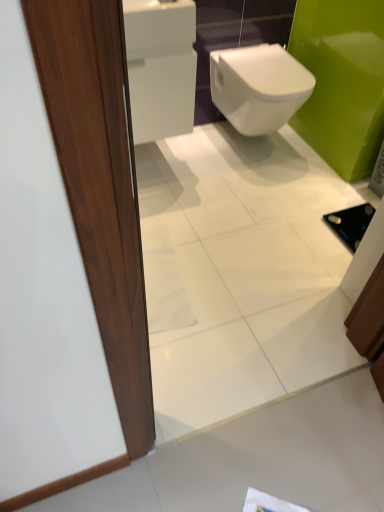
The width and height of the screenshot is (384, 512). What do you see at coordinates (239, 272) in the screenshot?
I see `matte wood door at left` at bounding box center [239, 272].

The height and width of the screenshot is (512, 384). Identify the location of white glossy tile at lower left. (107, 493).

The image size is (384, 512). What do you see at coordinates (107, 493) in the screenshot? I see `white glossy tile at lower left` at bounding box center [107, 493].

I want to click on white glossy bidet at center, so click(x=258, y=87).

Based on the photo, in order to face white glossy bidet at center, should I rotate leftwards or rightwards?

It's best to rotate right around 9.406 degrees.

Where is `matte wood door at left`? The image size is (384, 512). matte wood door at left is located at coordinates (239, 272).

Can you tell me how much white glossy tile at lower left and matte wood door at left differ in facing direction?

They differ by 180 degrees in their facing directions.

From the image's perspective, is white glossy tile at lower left on matte wood door at left?

No, from the image's perspective, white glossy tile at lower left is not over matte wood door at left.

Which of these two, white glossy tile at lower left or matte wood door at left, is bigger?

matte wood door at left is bigger.

Measure the distance between white glossy tile at lower left and matte wood door at left.

white glossy tile at lower left is 35.69 inches away from matte wood door at left.

Consider the image. How far apart are white paper at lower center and white glossy tile at lower left?

white paper at lower center is 38.47 centimeters away from white glossy tile at lower left.

Would you say white paper at lower center is a long distance from white glossy tile at lower left?

white paper at lower center is actually quite close to white glossy tile at lower left.

Does white paper at lower center turn towards white glossy tile at lower left?

No, white paper at lower center does not turn towards white glossy tile at lower left.

Is white paper at lower center inside the boundaries of white glossy tile at lower left, or outside?

white paper at lower center is not inside white glossy tile at lower left, it's outside.

Considering the sizes of matte wood door at left and white paper at lower center in the image, is matte wood door at left wider or thinner than white paper at lower center?

Considering their sizes, matte wood door at left looks slimmer than white paper at lower center.

Considering the positions of point (169, 10) and point (258, 504), is point (169, 10) closer or farther from the camera than point (258, 504)?

Point (169, 10) is positioned farther from the camera compared to point (258, 504).

Which object is closer to the camera taking this photo, matte wood door at left or white paper at lower center?

matte wood door at left is in front.

Locate an element on the screen. The width and height of the screenshot is (384, 512). mirror on the right side of white paper at lower center is located at coordinates (239, 272).

I want to click on bidet above the white glossy tile at lower left (from the image's perspective), so click(x=258, y=87).

Does point (37, 504) lie behind point (247, 103)?

No, it is not.

How different are the orientations of white glossy tile at lower left and white glossy bidet at center in degrees?

The angular difference between white glossy tile at lower left and white glossy bidet at center is 0.0342 degrees.

Between white glossy tile at lower left and white glossy bidet at center, which one has smaller size?

Smaller between the two is white glossy tile at lower left.

Considering the relative sizes of white paper at lower center and white glossy bidet at center in the image provided, is white paper at lower center bigger than white glossy bidet at center?

No, white paper at lower center is not bigger than white glossy bidet at center.

Which is farther, (273,504) or (213,77)?

Positioned behind is point (213,77).

Based on the photo, is white glossy bidet at center inside white paper at lower center?

That's incorrect, white glossy bidet at center is not inside white paper at lower center.

From a real-world perspective, relative to white glossy bidet at center, is white paper at lower center vertically above or below?

white paper at lower center is situated lower than white glossy bidet at center in the real world.

You are a GUI agent. You are given a task and a screenshot of the screen. Output one action in this format:
    pyautogui.click(x=<x>, y=<y>)
    Task: Click on the paper behind the matte wood door at left
    The image size is (384, 512).
    Given the screenshot: What is the action you would take?
    pyautogui.click(x=268, y=503)

From the image's perspective, is white paper at lower center beneath matte wood door at left?

Indeed, from the image's perspective, white paper at lower center is shown beneath matte wood door at left.

Considering the relative positions of white paper at lower center and matte wood door at left in the image provided, is white paper at lower center in front of matte wood door at left?

No.

Is point (281, 509) less distant than point (201, 289)?

Yes, point (281, 509) is closer to viewer.

From the image's perspective, is matte wood door at left over white glossy tile at lower left?

Yes.

Between matte wood door at left and white glossy tile at lower left, which one is positioned behind?

white glossy tile at lower left.

Between matte wood door at left and white glossy tile at lower left, which one appears on the left side from the viewer's perspective?

From the viewer's perspective, white glossy tile at lower left appears more on the left side.

Which of these two, matte wood door at left or white glossy tile at lower left, is bigger?

matte wood door at left.

Locate an element on the screen. Image resolution: width=384 pixels, height=512 pixels. tile below the matte wood door at left (from the image's perspective) is located at coordinates (107, 493).

Where is `tile that appears on the left of white paper at lower center`? tile that appears on the left of white paper at lower center is located at coordinates (107, 493).

Which object lies nearer to the anchor point white paper at lower center, white glossy tile at lower left or white glossy bidet at center?

Based on the image, white glossy tile at lower left appears to be nearer to white paper at lower center.

Based on the photo, which object lies nearer to the anchor point white glossy bidet at center, white paper at lower center or matte wood door at left?

Among the two, matte wood door at left is located nearer to white glossy bidet at center.

Which object lies further to the anchor point matte wood door at left, white glossy bidet at center or white glossy tile at lower left?

white glossy tile at lower left is further to matte wood door at left.

When comparing their distances from white glossy bidet at center, does white glossy tile at lower left or matte wood door at left seem further?

white glossy tile at lower left.

From the image, which object appears to be farther from white glossy tile at lower left, white paper at lower center or matte wood door at left?

matte wood door at left is further to white glossy tile at lower left.

Based on the photo, from the image, which object appears to be farther from white glossy tile at lower left, matte wood door at left or white glossy bidet at center?

white glossy bidet at center lies further to white glossy tile at lower left than the other object.

Based on their spatial positions, is matte wood door at left or white glossy bidet at center closer to white paper at lower center?

matte wood door at left is positioned closer to the anchor white paper at lower center.

Looking at this image, which object lies nearer to the anchor point matte wood door at left, white glossy tile at lower left or white paper at lower center?

white glossy tile at lower left.

You are a GUI agent. You are given a task and a screenshot of the screen. Output one action in this format:
    pyautogui.click(x=<x>, y=<y>)
    Task: Click on the tile between white glossy bidet at center and white paper at lower center in the up-down direction
    
    Given the screenshot: What is the action you would take?
    107,493

This screenshot has height=512, width=384. I want to click on mirror between white glossy bidet at center and white paper at lower center in the up-down direction, so click(x=239, y=272).

Locate an element on the screen. The height and width of the screenshot is (512, 384). mirror that lies between white glossy bidet at center and white glossy tile at lower left from top to bottom is located at coordinates (239, 272).

Find the location of `tile that lies between matte wood door at left and white paper at lower center from top to bottom`. tile that lies between matte wood door at left and white paper at lower center from top to bottom is located at coordinates (107, 493).